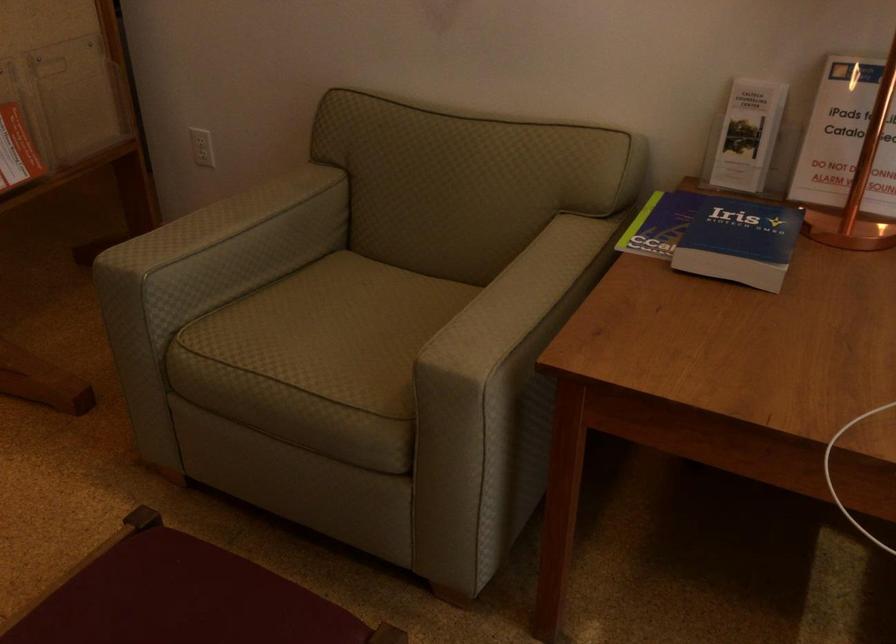
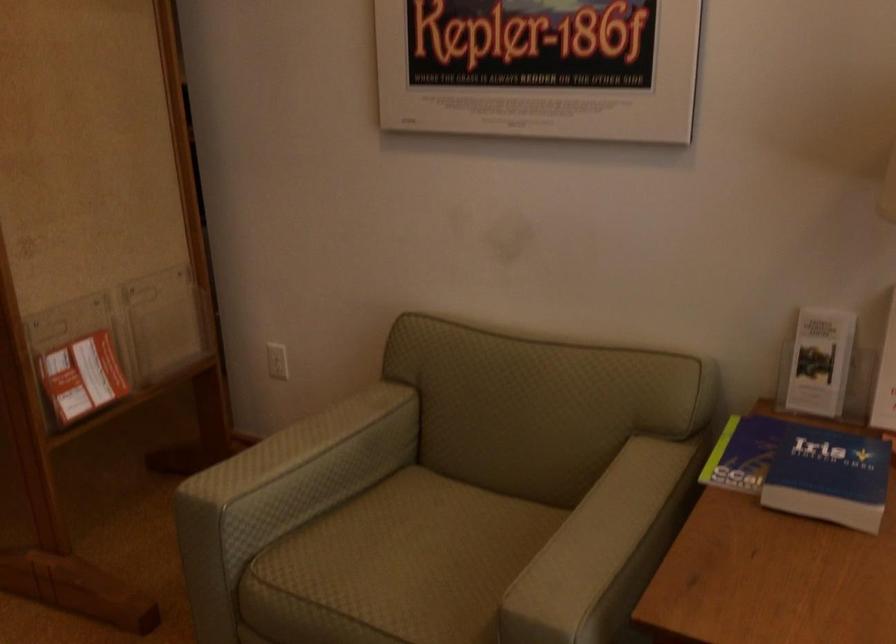
Looking at this image, the images are taken continuously from a first-person perspective. In which direction are you moving?

The cameraman moved toward left, backward.